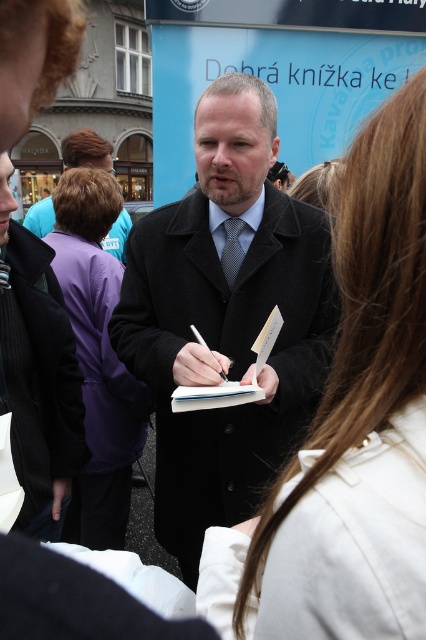
You are organizing a charity event and need to decide which purple jacket to donate. Both the purple fleece jacket at center and the purple fabric jacket at upper left are available. Which one is smaller and more suitable for a child?

The purple fleece jacket at center is smaller than the purple fabric jacket at upper left, making it more suitable for a child.

You are an event planner organizing a signing event and need to ensure the attendees can see the author clearly. Given the purple fleece jacket at center and the dark blue textured tie at center, which object is positioned lower and might block the view of the tie?

The purple fleece jacket at center is located below the dark blue textured tie at center, so it might block the view of the tie.

Consider the image. You are standing at the origin point in the scene. Where is the white fabric coat at center located in terms of coordinates?

The white fabric coat at center is located at point (351,429).